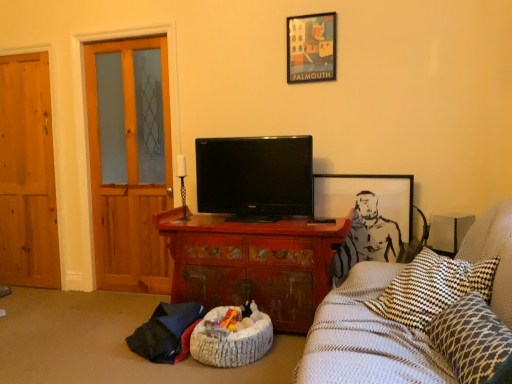
The width and height of the screenshot is (512, 384). What do you see at coordinates (311, 48) in the screenshot? I see `metallic framed poster at upper center, which is counted as the 2th picture frame, starting from the bottom` at bounding box center [311, 48].

The image size is (512, 384). I want to click on gray paper picture frame at upper right, the second picture frame when ordered from top to bottom, so click(x=366, y=190).

In order to face gray paper picture frame at upper right, the second picture frame when ordered from top to bottom, should I rotate leftwards or rightwards?

To face it directly, rotate right by 14.068 degrees.

This screenshot has height=384, width=512. Describe the element at coordinates (27, 175) in the screenshot. I see `wooden door at left, the second door viewed from the right` at that location.

Identify the location of black glossy tv at center. (255, 177).

From the image's perspective, starting from the black glossy tv at center, which door is the 2nd one above? Please provide its 2D coordinates.

[(131, 167)]

From the picture: Which is correct: black glossy tv at center is inside wooden door at left, acting as the 1th door starting from the right, or outside of it?

black glossy tv at center is not inside wooden door at left, acting as the 1th door starting from the right, it's outside.

Is black glossy tv at center facing towards wooden door at left, acting as the 1th door starting from the right?

No, black glossy tv at center is not facing towards wooden door at left, acting as the 1th door starting from the right.

Who is shorter, white textured infant bed at lower center or black glossy tv at center?

white textured infant bed at lower center.

Would you say white textured infant bed at lower center is a long distance from black glossy tv at center?

No, white textured infant bed at lower center is not far from black glossy tv at center.

This screenshot has width=512, height=384. I want to click on television above the white textured infant bed at lower center (from the image's perspective), so coord(255,177).

Consider the image. Looking at their sizes, would you say white textured infant bed at lower center is wider or thinner than black glossy tv at center?

Clearly, white textured infant bed at lower center has more width compared to black glossy tv at center.

Is wooden door at left, acting as the 1th door starting from the right, looking in the opposite direction of white textured blanket at right?

wooden door at left, acting as the 1th door starting from the right, is not turned away from white textured blanket at right.

From a real-world perspective, is wooden door at left, acting as the 1th door starting from the right, positioned under white textured blanket at right based on gravity?

No, from a real-world perspective, wooden door at left, acting as the 1th door starting from the right, is not beneath white textured blanket at right.

Which of these two, wooden door at left, acting as the 1th door starting from the right, or white textured blanket at right, is smaller?

Smaller between the two is wooden door at left, acting as the 1th door starting from the right.

How much distance is there between gray paper picture frame at upper right, the second picture frame when ordered from top to bottom, and white textured infant bed at lower center?

gray paper picture frame at upper right, the second picture frame when ordered from top to bottom, and white textured infant bed at lower center are 3.37 feet apart from each other.

Can you confirm if gray paper picture frame at upper right, the second picture frame when ordered from top to bottom, is thinner than white textured infant bed at lower center?

Indeed, gray paper picture frame at upper right, the second picture frame when ordered from top to bottom, has a lesser width compared to white textured infant bed at lower center.

Considering the positions of objects gray paper picture frame at upper right, the second picture frame when ordered from top to bottom, and white textured infant bed at lower center in the image provided, who is in front, gray paper picture frame at upper right, the second picture frame when ordered from top to bottom, or white textured infant bed at lower center?

Positioned in front is white textured infant bed at lower center.

Are gray paper picture frame at upper right, the second picture frame when ordered from top to bottom, and white textured infant bed at lower center far apart?

Yes, gray paper picture frame at upper right, the second picture frame when ordered from top to bottom, is far from white textured infant bed at lower center.

Which object is thinner, gray paper picture frame at upper right, which is the first picture frame from bottom to top, or metallic framed poster at upper center, acting as the first picture frame starting from the top?

metallic framed poster at upper center, acting as the first picture frame starting from the top, is thinner.

Between gray paper picture frame at upper right, the second picture frame when ordered from top to bottom, and metallic framed poster at upper center, which is counted as the 2th picture frame, starting from the bottom, which one has larger size?

Bigger between the two is gray paper picture frame at upper right, the second picture frame when ordered from top to bottom.

Is there a large distance between gray paper picture frame at upper right, the second picture frame when ordered from top to bottom, and metallic framed poster at upper center, which is counted as the 2th picture frame, starting from the bottom?

gray paper picture frame at upper right, the second picture frame when ordered from top to bottom, is near metallic framed poster at upper center, which is counted as the 2th picture frame, starting from the bottom, not far away.

From a real-world perspective, who is located lower, gray paper picture frame at upper right, which is the first picture frame from bottom to top, or metallic framed poster at upper center, acting as the first picture frame starting from the top?

gray paper picture frame at upper right, which is the first picture frame from bottom to top, from a real-world perspective.

Would you say black glossy tv at center contains metallic framed poster at upper center, which is counted as the 2th picture frame, starting from the bottom?

No, metallic framed poster at upper center, which is counted as the 2th picture frame, starting from the bottom, is not inside black glossy tv at center.

The height and width of the screenshot is (384, 512). I want to click on television below the metallic framed poster at upper center, acting as the first picture frame starting from the top (from the image's perspective), so click(255, 177).

From the image's perspective, which one is positioned higher, black glossy tv at center or metallic framed poster at upper center, acting as the first picture frame starting from the top?

metallic framed poster at upper center, acting as the first picture frame starting from the top, is shown above in the image.

What's the angular difference between black glossy tv at center and metallic framed poster at upper center, acting as the first picture frame starting from the top,'s facing directions?

0.922 degrees separate the facing orientations of black glossy tv at center and metallic framed poster at upper center, acting as the first picture frame starting from the top.

Is white textured blanket at right positioned with its back to leopard print cushion at lower right?

That's not correct — white textured blanket at right is not looking away from leopard print cushion at lower right.

Does white textured blanket at right touch leopard print cushion at lower right?

There is a gap between white textured blanket at right and leopard print cushion at lower right.

Can we say white textured blanket at right lies outside leopard print cushion at lower right?

Yes, white textured blanket at right is not within leopard print cushion at lower right.

This screenshot has height=384, width=512. I want to click on the 2nd door above the black glossy tv at center (from a real-world perspective), so click(x=131, y=167).

Where is `infant bed below the black glossy tv at center (from a real-world perspective)`? This screenshot has width=512, height=384. infant bed below the black glossy tv at center (from a real-world perspective) is located at coordinates (231, 339).

Based on the photo, estimate the real-world distances between objects in this image. Which object is further from wooden door at left, which is the 1th door in left-to-right order, leopard print cushion at lower right or white textured blanket at right?

The object further to wooden door at left, which is the 1th door in left-to-right order, is leopard print cushion at lower right.

In the scene shown: Estimate the real-world distances between objects in this image. Which object is further from distressed wood cabinet at center, wooden door at left, the second door viewed from the right, or white textured infant bed at lower center?

wooden door at left, the second door viewed from the right, lies further to distressed wood cabinet at center than the other object.

When comparing their distances from metallic framed poster at upper center, which is counted as the 2th picture frame, starting from the bottom, does leopard print cushion at lower right or distressed wood cabinet at center seem closer?

distressed wood cabinet at center lies closer to metallic framed poster at upper center, which is counted as the 2th picture frame, starting from the bottom, than the other object.

Considering their positions, is wooden door at left, acting as the 1th door starting from the right, positioned closer to white textured infant bed at lower center than gray paper picture frame at upper right, which is the first picture frame from bottom to top?

gray paper picture frame at upper right, which is the first picture frame from bottom to top, is positioned closer to the anchor white textured infant bed at lower center.

When comparing their distances from wooden door at left, acting as the 1th door starting from the right, does metallic framed poster at upper center, acting as the first picture frame starting from the top, or gray paper picture frame at upper right, which is the first picture frame from bottom to top, seem closer?

metallic framed poster at upper center, acting as the first picture frame starting from the top, lies closer to wooden door at left, acting as the 1th door starting from the right, than the other object.

From the image, which object appears to be farther from gray paper picture frame at upper right, the second picture frame when ordered from top to bottom, white textured blanket at right or white textured infant bed at lower center?

white textured infant bed at lower center.

Which object lies nearer to the anchor point leopard print cushion at lower right, gray paper picture frame at upper right, which is the first picture frame from bottom to top, or white textured blanket at right?

white textured blanket at right.

Considering their positions, is gray paper picture frame at upper right, which is the first picture frame from bottom to top, positioned further to black glossy tv at center than leopard print cushion at lower right?

leopard print cushion at lower right lies further to black glossy tv at center than the other object.

I want to click on studio couch between leopard print cushion at lower right and black glossy tv at center from front to back, so click(x=366, y=339).

This screenshot has width=512, height=384. I want to click on television between leopard print cushion at lower right and metallic framed poster at upper center, acting as the first picture frame starting from the top, in the front-back direction, so click(255, 177).

Identify the location of television between wooden door at left, acting as the 1th door starting from the right, and gray paper picture frame at upper right, which is the first picture frame from bottom to top, from left to right. This screenshot has height=384, width=512. [255, 177].

The image size is (512, 384). In order to click on infant bed situated between wooden door at left, the second door viewed from the right, and distressed wood cabinet at center from left to right in this screenshot , I will do `click(231, 339)`.